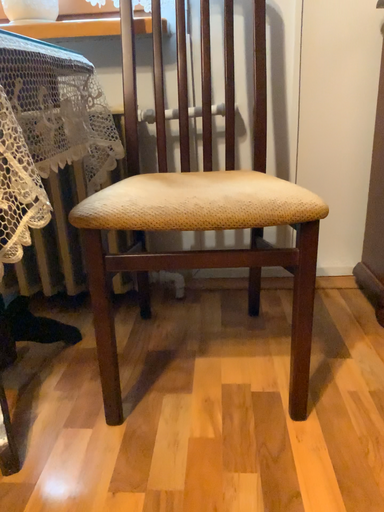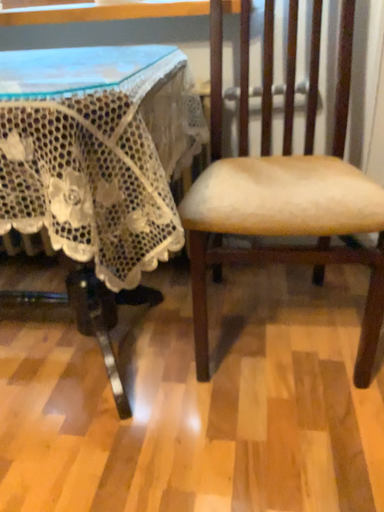
Question: Which way did the camera rotate in the video?

Choices:
 (A) rotated upward
 (B) rotated downward

Answer: (B)